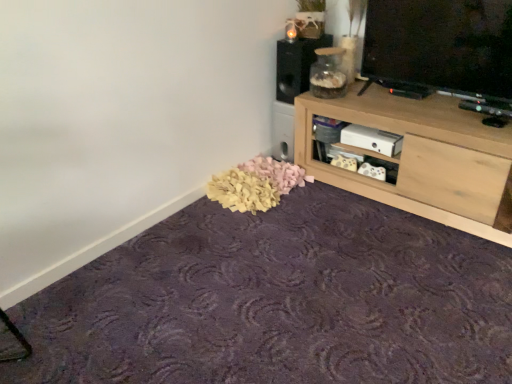
Question: Is purple textured carpet at lower center positioned before black matte speaker at upper center?

Choices:
 (A) yes
 (B) no

Answer: (A)

Question: From the image's perspective, is purple textured carpet at lower center beneath black matte speaker at upper center?

Choices:
 (A) no
 (B) yes

Answer: (B)

Question: Considering the relative positions of purple textured carpet at lower center and black matte speaker at upper center in the image provided, is purple textured carpet at lower center to the left of black matte speaker at upper center from the viewer's perspective?

Choices:
 (A) no
 (B) yes

Answer: (B)

Question: Considering the relative sizes of purple textured carpet at lower center and black matte speaker at upper center in the image provided, is purple textured carpet at lower center shorter than black matte speaker at upper center?

Choices:
 (A) no
 (B) yes

Answer: (B)

Question: Considering the relative sizes of purple textured carpet at lower center and black matte speaker at upper center in the image provided, is purple textured carpet at lower center thinner than black matte speaker at upper center?

Choices:
 (A) yes
 (B) no

Answer: (B)

Question: In the image, is black matte speaker at upper center positioned in front of or behind purple textured carpet at lower center?

Choices:
 (A) front
 (B) behind

Answer: (B)

Question: From a real-world perspective, relative to purple textured carpet at lower center, is black matte speaker at upper center vertically above or below?

Choices:
 (A) above
 (B) below

Answer: (A)

Question: Looking at the image, does black matte speaker at upper center seem bigger or smaller compared to purple textured carpet at lower center?

Choices:
 (A) big
 (B) small

Answer: (B)

Question: From the image's perspective, is black matte speaker at upper center above or below purple textured carpet at lower center?

Choices:
 (A) above
 (B) below

Answer: (A)

Question: Considering the positions of purple textured carpet at lower center and light wood shelf at upper right in the image, is purple textured carpet at lower center taller or shorter than light wood shelf at upper right?

Choices:
 (A) tall
 (B) short

Answer: (B)

Question: From a real-world perspective, relative to light wood shelf at upper right, is purple textured carpet at lower center vertically above or below?

Choices:
 (A) below
 (B) above

Answer: (A)

Question: From the image's perspective, is purple textured carpet at lower center positioned above or below light wood shelf at upper right?

Choices:
 (A) above
 (B) below

Answer: (B)

Question: Considering the positions of purple textured carpet at lower center and light wood shelf at upper right in the image, is purple textured carpet at lower center wider or thinner than light wood shelf at upper right?

Choices:
 (A) wide
 (B) thin

Answer: (A)

Question: From a real-world perspective, relative to transparent glass jar at upper right, is black matte speaker at upper center vertically above or below?

Choices:
 (A) below
 (B) above

Answer: (A)

Question: From the image's perspective, is black matte speaker at upper center above or below transparent glass jar at upper right?

Choices:
 (A) below
 (B) above

Answer: (B)